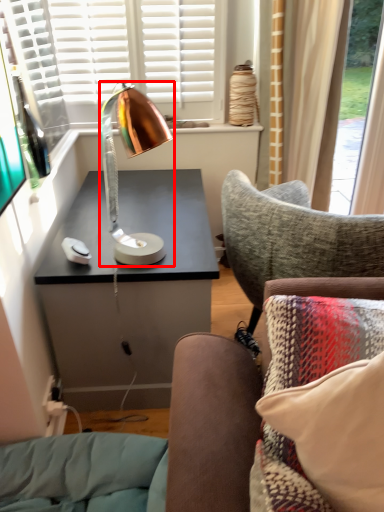
Question: From the image's perspective, where is lamp (annotated by the red box) located in relation to pillow in the image?

Choices:
 (A) above
 (B) below

Answer: (A)